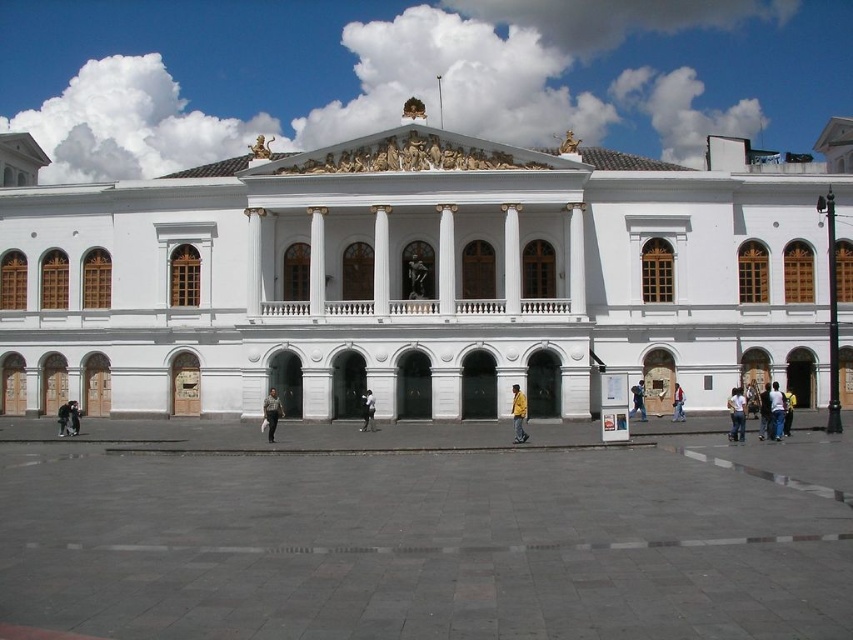
You are standing in front of the grand neoclassical building and see a light brown leather jacket at center and a denim jacket at lower right. Which jacket is closer to the left side of the building?

The light brown leather jacket at center is positioned on the left side of the denim jacket at lower right, so it is closer to the left side of the building.

You are a delivery person standing at the entrance of the grand neoclassical building. You need to deliver a package to a person wearing a denim jacket at lower right and another to someone wearing a black leather jacket at lower left. Given that your delivery cart can only carry items up to 200 feet apart, can you deliver both packages in one trip without exceeding the cart capacity?

The distance between the denim jacket at lower right and the black leather jacket at lower left is 186.35 feet, which is under the cart capacity of 200 feet. Therefore, you can deliver both packages in one trip.

You are standing in front of the grand neoclassical building and see a denim jacket at lower right and a black leather jacket at lower left. Which jacket is nearer to you?

The denim jacket at lower right is closer to the viewer than the black leather jacket at lower left.